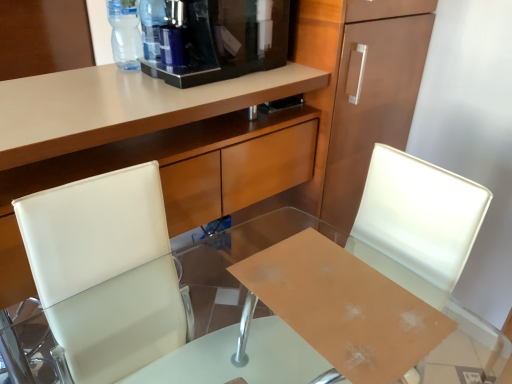
Question: Is transparent plastic bottle at upper center, marked as the second bottle in a right-to-left arrangement, completely or partially inside white leather chair at center?

Choices:
 (A) no
 (B) yes

Answer: (A)

Question: From a real-world perspective, is white leather chair at center on top of transparent plastic bottle at upper center, marked as the second bottle in a right-to-left arrangement?

Choices:
 (A) no
 (B) yes

Answer: (A)

Question: Are white leather chair at center and transparent plastic bottle at upper center, the first bottle viewed from the left, beside each other?

Choices:
 (A) no
 (B) yes

Answer: (A)

Question: Is white leather chair at center to the left of transparent plastic bottle at upper center, marked as the second bottle in a right-to-left arrangement, from the viewer's perspective?

Choices:
 (A) yes
 (B) no

Answer: (B)

Question: Considering the relative sizes of white leather chair at center and transparent plastic bottle at upper center, the first bottle viewed from the left, in the image provided, is white leather chair at center taller than transparent plastic bottle at upper center, the first bottle viewed from the left,?

Choices:
 (A) no
 (B) yes

Answer: (B)

Question: Considering the positions of matte wood cabinet at upper center and white leather chair at center in the image, is matte wood cabinet at upper center taller or shorter than white leather chair at center?

Choices:
 (A) short
 (B) tall

Answer: (B)

Question: Choose the correct answer: Is matte wood cabinet at upper center inside white leather chair at center or outside it?

Choices:
 (A) inside
 (B) outside

Answer: (B)

Question: Considering the positions of point (125, 91) and point (477, 218), is point (125, 91) closer or farther from the camera than point (477, 218)?

Choices:
 (A) closer
 (B) farther

Answer: (B)

Question: From a real-world perspective, is matte wood cabinet at upper center positioned above or below white leather chair at center?

Choices:
 (A) above
 (B) below

Answer: (A)

Question: From the image's perspective, relative to transparent glass desk at center, is transparent plastic bottle at upper center, positioned as the second bottle in left-to-right order, above or below?

Choices:
 (A) above
 (B) below

Answer: (A)

Question: Looking at their shapes, would you say transparent plastic bottle at upper center, positioned as the second bottle in left-to-right order, is wider or thinner than transparent glass desk at center?

Choices:
 (A) thin
 (B) wide

Answer: (A)

Question: Would you say transparent plastic bottle at upper center, placed as the 1th bottle when sorted from right to left, is to the left or to the right of transparent glass desk at center in the picture?

Choices:
 (A) right
 (B) left

Answer: (B)

Question: In terms of size, does transparent plastic bottle at upper center, placed as the 1th bottle when sorted from right to left, appear bigger or smaller than transparent glass desk at center?

Choices:
 (A) big
 (B) small

Answer: (B)

Question: Is black glossy coffee machine at upper center in front of or behind white leather swivel chair at center in the image?

Choices:
 (A) front
 (B) behind

Answer: (B)

Question: Is point (276, 23) closer or farther from the camera than point (117, 228)?

Choices:
 (A) farther
 (B) closer

Answer: (A)